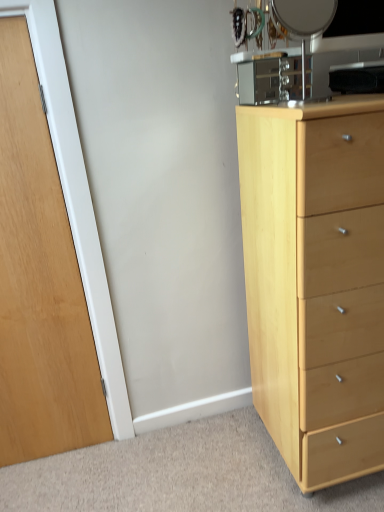
Question: From the image's perspective, is light wood chest of drawers at right over metallic silver mirror at upper right?

Choices:
 (A) no
 (B) yes

Answer: (A)

Question: Is light wood chest of drawers at right in front of metallic silver mirror at upper right?

Choices:
 (A) yes
 (B) no

Answer: (A)

Question: Can you confirm if light wood chest of drawers at right is positioned to the right of metallic silver mirror at upper right?

Choices:
 (A) no
 (B) yes

Answer: (B)

Question: Does light wood chest of drawers at right have a lesser width compared to metallic silver mirror at upper right?

Choices:
 (A) no
 (B) yes

Answer: (A)

Question: From the image's perspective, is light wood chest of drawers at right under metallic silver mirror at upper right?

Choices:
 (A) no
 (B) yes

Answer: (B)

Question: Considering the relative positions of light wood chest of drawers at right and metallic silver mirror at upper right in the image provided, is light wood chest of drawers at right behind metallic silver mirror at upper right?

Choices:
 (A) no
 (B) yes

Answer: (A)

Question: Is wooden door at left a part of light wood chest of drawers at right?

Choices:
 (A) no
 (B) yes

Answer: (A)

Question: Are light wood chest of drawers at right and wooden door at left far apart?

Choices:
 (A) yes
 (B) no

Answer: (B)

Question: Is light wood chest of drawers at right smaller than wooden door at left?

Choices:
 (A) no
 (B) yes

Answer: (A)

Question: Is light wood chest of drawers at right closer to the viewer compared to wooden door at left?

Choices:
 (A) no
 (B) yes

Answer: (B)

Question: Does light wood chest of drawers at right appear on the left side of wooden door at left?

Choices:
 (A) no
 (B) yes

Answer: (A)

Question: Does light wood chest of drawers at right have a lesser width compared to wooden door at left?

Choices:
 (A) yes
 (B) no

Answer: (B)

Question: Is metallic silver mirror at upper right outside of wooden door at left?

Choices:
 (A) yes
 (B) no

Answer: (A)